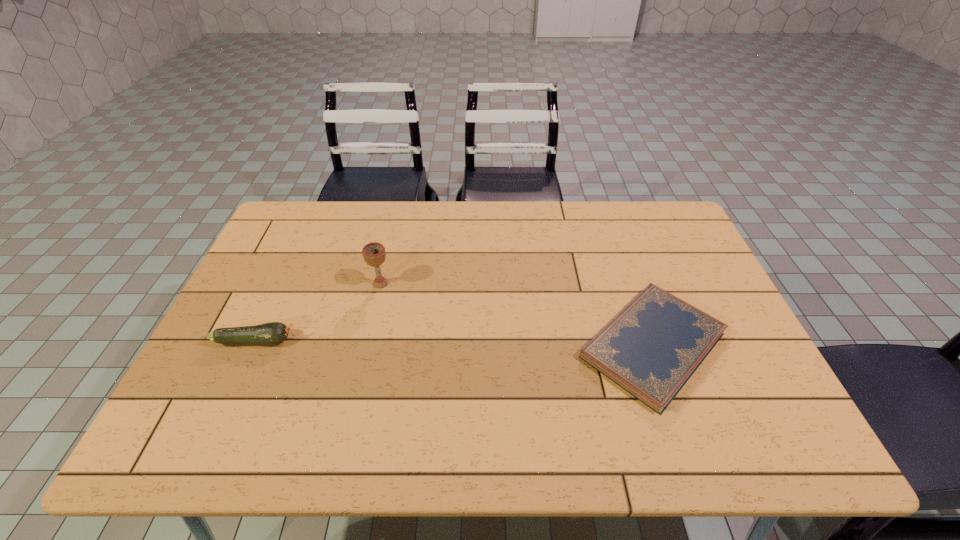
I want to click on the tallest object, so 374,254.

Where is `chalice`? This screenshot has width=960, height=540. chalice is located at coordinates (374, 254).

Find the location of a particular element. the leftmost object is located at coordinates (272, 333).

The image size is (960, 540). Identify the location of the second shortest object. (272, 333).

This screenshot has width=960, height=540. Find the location of `the rightmost object`. the rightmost object is located at coordinates (651, 348).

At what (x,y) coordinates should I click in order to perform the action: click on paperback book. Please return your answer as a coordinate pair (x, y). Looking at the image, I should click on (651, 348).

Where is `free region located 0.360m on the right of the chalice`? free region located 0.360m on the right of the chalice is located at coordinates (515, 284).

At what (x,y) coordinates should I click in order to perform the action: click on free space located 0.320m at the blossom end of the second tallest object. Please return your answer as a coordinate pair (x, y). Looking at the image, I should click on (420, 340).

Where is `free location located 0.320m on the back of the shortest object`? free location located 0.320m on the back of the shortest object is located at coordinates (611, 223).

You are a GUI agent. You are given a task and a screenshot of the screen. Output one action in this format:
    pyautogui.click(x=<x>, y=<y>)
    Task: Click on the object that is at the left edge
    The width and height of the screenshot is (960, 540).
    Given the screenshot: What is the action you would take?
    pyautogui.click(x=272, y=333)